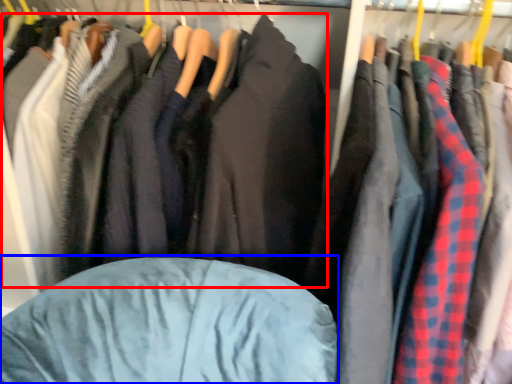
Question: Which object appears farthest to the camera in this image, jacket (highlighted by a red box) or bean bag chair (highlighted by a blue box)?

Choices:
 (A) jacket
 (B) bean bag chair

Answer: (A)